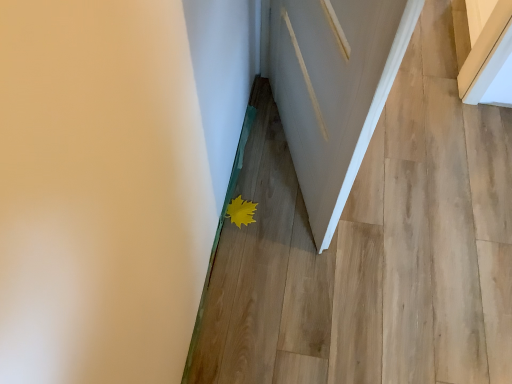
You are a GUI agent. You are given a task and a screenshot of the screen. Output one action in this format:
    pyautogui.click(x=<x>, y=<y>)
    Task: Click on the free location in front of yellow matte leaf at lower center
    This screenshot has width=512, height=384.
    Given the screenshot: What is the action you would take?
    pyautogui.click(x=247, y=256)